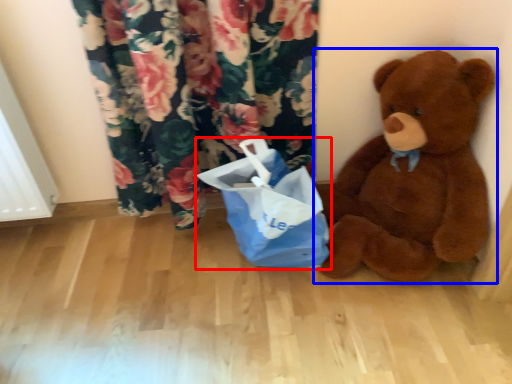
Question: Which point is further to the camera, shopping bag (highlighted by a red box) or teddy bear (highlighted by a blue box)?

Choices:
 (A) shopping bag
 (B) teddy bear

Answer: (A)